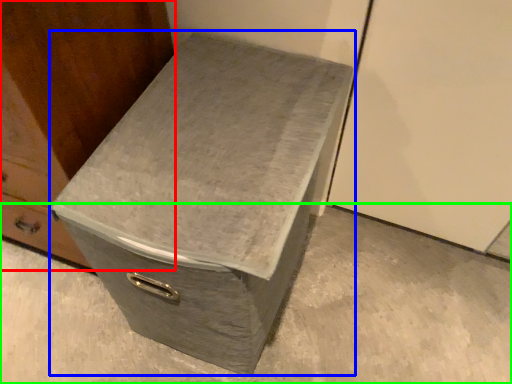
Question: Considering the real-world distances, which object is closest to furniture (highlighted by a red box)? shoe box (highlighted by a blue box) or concrete (highlighted by a green box).

Choices:
 (A) shoe box
 (B) concrete

Answer: (A)